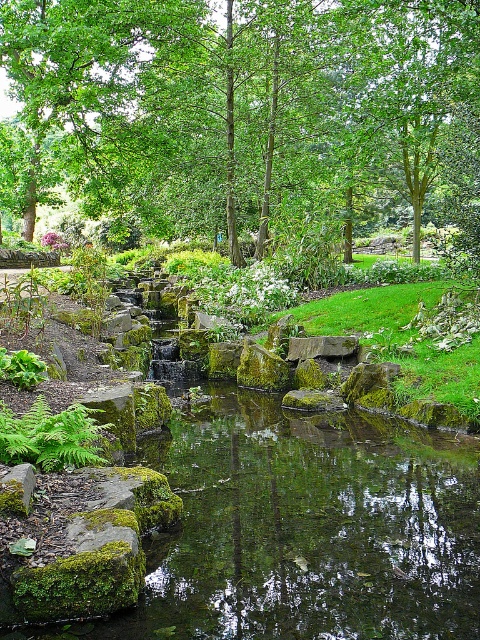
Which is more to the right, green leafy tree at upper center or green matte fern at lower left?

From the viewer's perspective, green leafy tree at upper center appears more on the right side.

Is point (277, 131) less distant than point (71, 413)?

No.

Find the location of a particular element. green leafy tree at upper center is located at coordinates (235, 102).

Can you confirm if green leafy tree at upper center is taller than green mossy stone at center?

Correct, green leafy tree at upper center is much taller as green mossy stone at center.

Does green leafy tree at upper center come in front of green mossy stone at center?

No, it is behind green mossy stone at center.

Is point (57, 109) more distant than point (302, 339)?

Yes, it is.

Locate an element on the screen. The image size is (480, 640). green leafy tree at upper center is located at coordinates (235, 102).

Based on the photo, who is positioned more to the right, green matte fern at lower left or green mossy stone at center?

green mossy stone at center is more to the right.

Locate an element on the screen. This screenshot has height=640, width=480. green matte fern at lower left is located at coordinates (51, 436).